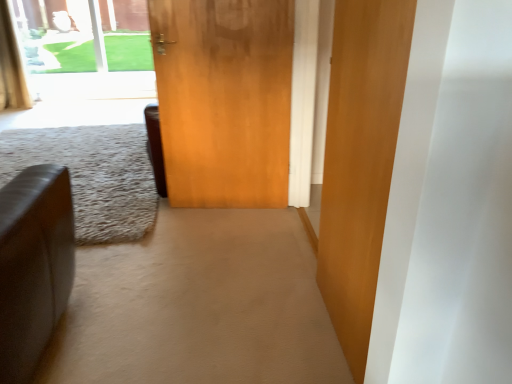
Question: Can we say wooden door at center, acting as the 2th door starting from the front, lies outside leather couch at left?

Choices:
 (A) no
 (B) yes

Answer: (B)

Question: From a real-world perspective, is wooden door at center, acting as the 2th door starting from the front, positioned over leather couch at left based on gravity?

Choices:
 (A) yes
 (B) no

Answer: (A)

Question: From a real-world perspective, is wooden door at center, acting as the 2th door starting from the front, beneath leather couch at left?

Choices:
 (A) yes
 (B) no

Answer: (B)

Question: Can you see wooden door at center, acting as the 2th door starting from the front, touching leather couch at left?

Choices:
 (A) no
 (B) yes

Answer: (A)

Question: From the image's perspective, is wooden door at center, placed as the 1th door when sorted from left to right, over leather couch at left?

Choices:
 (A) yes
 (B) no

Answer: (A)

Question: Is wooden door at center, acting as the first door starting from the front, taller or shorter than leather couch at left?

Choices:
 (A) short
 (B) tall

Answer: (B)

Question: From the image's perspective, is wooden door at center, acting as the 2th door starting from the left, positioned above or below leather couch at left?

Choices:
 (A) above
 (B) below

Answer: (B)

Question: In terms of width, does wooden door at center, acting as the 2th door starting from the left, look wider or thinner when compared to leather couch at left?

Choices:
 (A) wide
 (B) thin

Answer: (B)

Question: In the image, is wooden door at center, acting as the second door starting from the back, positioned in front of or behind leather couch at left?

Choices:
 (A) front
 (B) behind

Answer: (A)

Question: Is wooden door at center, acting as the second door starting from the back, inside or outside of gold textured curtain at upper left?

Choices:
 (A) outside
 (B) inside

Answer: (A)

Question: Is wooden door at center, acting as the 2th door starting from the left, bigger or smaller than gold textured curtain at upper left?

Choices:
 (A) big
 (B) small

Answer: (B)

Question: In the image, is wooden door at center, acting as the second door starting from the back, on the left side or the right side of gold textured curtain at upper left?

Choices:
 (A) left
 (B) right

Answer: (B)

Question: From a real-world perspective, is wooden door at center, acting as the second door starting from the back, positioned above or below gold textured curtain at upper left?

Choices:
 (A) below
 (B) above

Answer: (B)

Question: Is wooden door at center, placed as the 1th door when sorted from left to right, bigger or smaller than wooden door at center, acting as the second door starting from the back?

Choices:
 (A) small
 (B) big

Answer: (B)

Question: From a real-world perspective, relative to wooden door at center, acting as the second door starting from the back, is wooden door at center, placed as the 1th door when sorted from left to right, vertically above or below?

Choices:
 (A) above
 (B) below

Answer: (B)